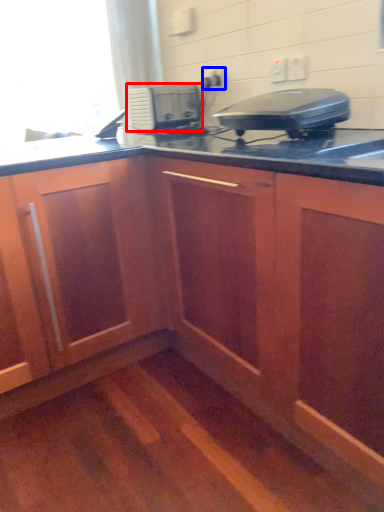
Question: Which object is further to the camera taking this photo, home appliance (highlighted by a red box) or electric outlet (highlighted by a blue box)?

Choices:
 (A) home appliance
 (B) electric outlet

Answer: (B)